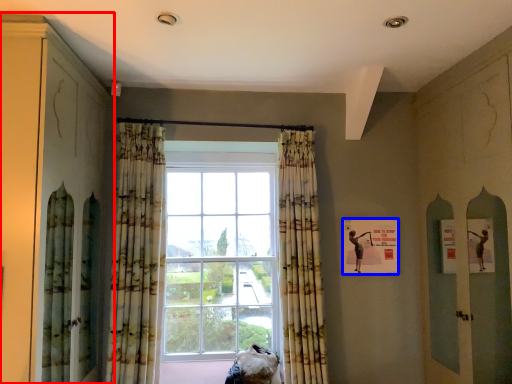
Question: Which object is closer to the camera taking this photo, cabinetry (highlighted by a red box) or poster (highlighted by a blue box)?

Choices:
 (A) cabinetry
 (B) poster

Answer: (A)